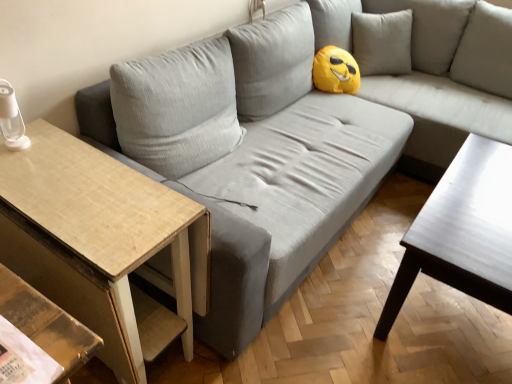
Question: From a real-world perspective, is shiny dark wood coffee table at right positioned above or below wooden textured table at left?

Choices:
 (A) above
 (B) below

Answer: (B)

Question: Considering the positions of shiny dark wood coffee table at right and wooden textured table at left in the image, is shiny dark wood coffee table at right bigger or smaller than wooden textured table at left?

Choices:
 (A) big
 (B) small

Answer: (A)

Question: In terms of width, does shiny dark wood coffee table at right look wider or thinner when compared to wooden textured table at left?

Choices:
 (A) thin
 (B) wide

Answer: (A)

Question: From the image's perspective, is wooden textured table at left located above or below shiny dark wood coffee table at right?

Choices:
 (A) above
 (B) below

Answer: (B)

Question: Visually, is wooden textured table at left positioned to the left or to the right of shiny dark wood coffee table at right?

Choices:
 (A) right
 (B) left

Answer: (B)

Question: In the image, is wooden textured table at left positioned in front of or behind shiny dark wood coffee table at right?

Choices:
 (A) front
 (B) behind

Answer: (A)

Question: In terms of width, does wooden textured table at left look wider or thinner when compared to shiny dark wood coffee table at right?

Choices:
 (A) thin
 (B) wide

Answer: (B)